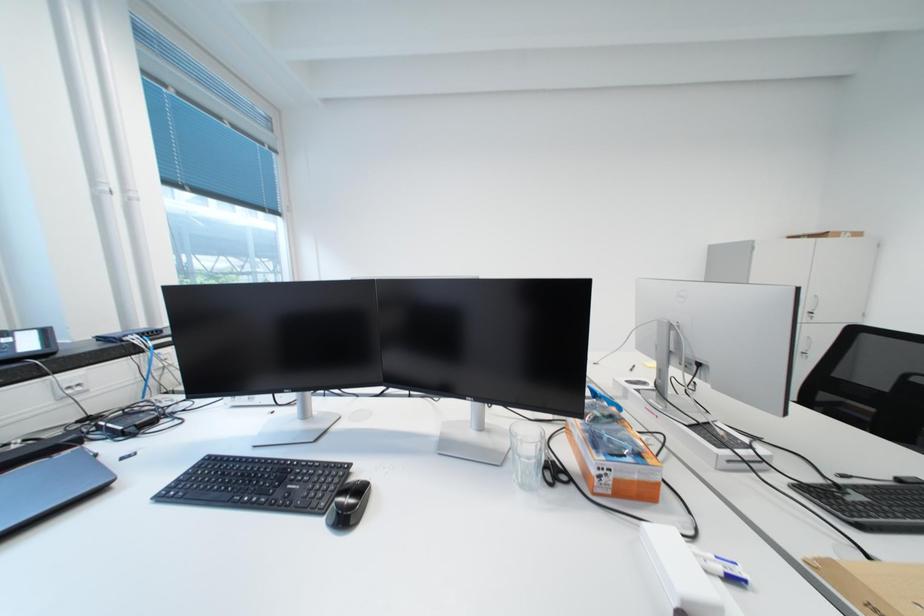
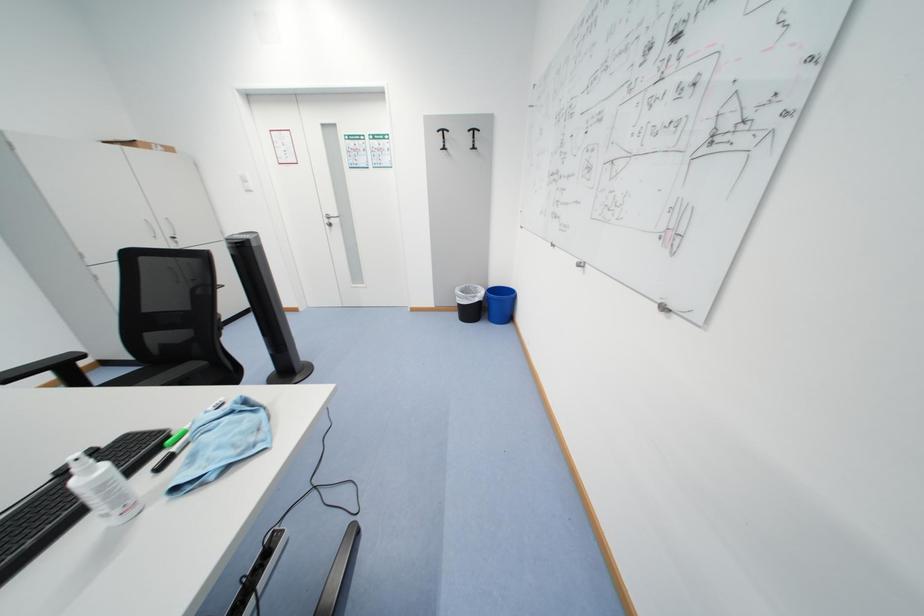
How did the camera likely rotate?

The camera's rotation is toward right-down.